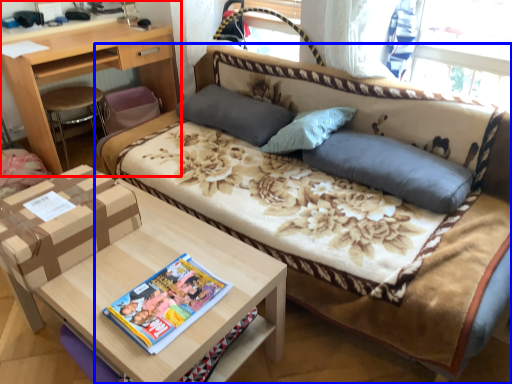
Question: Which point is further to the camera, desk (highlighted by a red box) or studio couch (highlighted by a blue box)?

Choices:
 (A) desk
 (B) studio couch

Answer: (A)